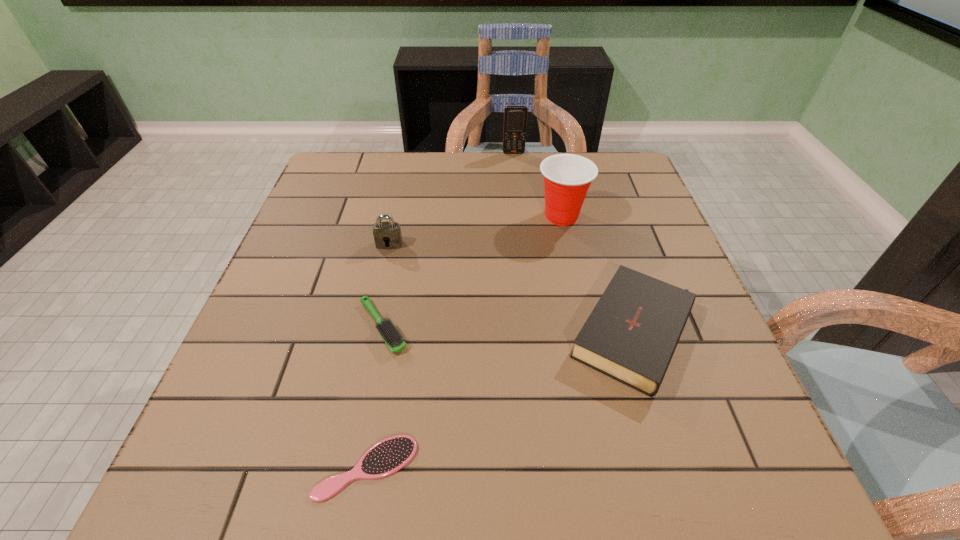
The height and width of the screenshot is (540, 960). Find the location of `cellular telephone`. cellular telephone is located at coordinates (515, 116).

Where is `the farthest object`? This screenshot has height=540, width=960. the farthest object is located at coordinates (515, 116).

The image size is (960, 540). Find the location of `cup`. cup is located at coordinates (567, 177).

Image resolution: width=960 pixels, height=540 pixels. In order to click on padlock in this screenshot , I will do `click(387, 235)`.

Where is `the fourth nearest object`? the fourth nearest object is located at coordinates (387, 235).

The height and width of the screenshot is (540, 960). Find the location of `the fourth tallest object`. the fourth tallest object is located at coordinates (631, 335).

Identify the location of the taller hairbrush. (392, 337).

Where is `the farther hairbrush`? The image size is (960, 540). the farther hairbrush is located at coordinates (392, 337).

Where is `the shorter hairbrush`? the shorter hairbrush is located at coordinates (386, 457).

Where is `the shortest object`? the shortest object is located at coordinates (386, 457).